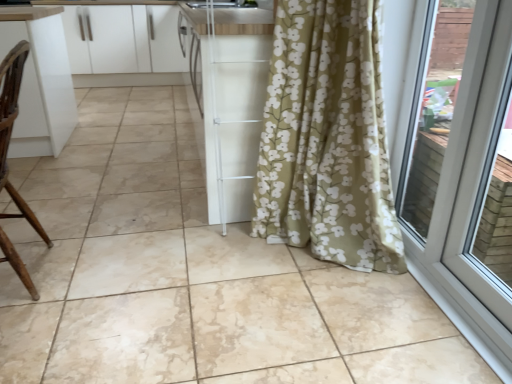
In order to click on white glossy cabinets at upper left in this screenshot , I will do `click(123, 39)`.

Considering the sizes of objects brown wood chair at left and white plastic door at right in the image provided, who is taller, brown wood chair at left or white plastic door at right?

white plastic door at right is taller.

Is brown wood chair at left positioned with its back to white plastic door at right?

Yes, brown wood chair at left is facing away from white plastic door at right.

From the image's perspective, is brown wood chair at left beneath white plastic door at right?

No, from the image's perspective, brown wood chair at left is not below white plastic door at right.

Would you consider brown wood chair at left to be distant from white plastic door at right?

Yes.

Is white glossy cabinets at upper left smaller than white plastic door at right?

No.

Is white glossy cabinets at upper left positioned with its back to white plastic door at right?

No, white glossy cabinets at upper left is not facing the opposite direction of white plastic door at right.

Considering the points (92, 9) and (480, 277), which point is behind, point (92, 9) or point (480, 277)?

The point (92, 9) is farther from the camera.

From the picture: How different are the orientations of white glossy cabinets at upper left and white plastic door at right in degrees?

white glossy cabinets at upper left and white plastic door at right are facing 90.2 degrees away from each other.

Which of these two, white plastic door at right or white glossy cabinets at upper left, stands shorter?

white glossy cabinets at upper left.

From a real-world perspective, is white plastic door at right on white glossy cabinets at upper left?

Yes, from a real-world perspective, white plastic door at right is on top of white glossy cabinets at upper left.

Which object is positioned more to the right, white plastic door at right or white glossy cabinets at upper left?

From the viewer's perspective, white plastic door at right appears more on the right side.

From the image's perspective, would you say white plastic door at right is shown under white glossy cabinets at upper left?

Yes.

Does white glossy cabinets at upper left have a greater height compared to brown wood chair at left?

Incorrect, the height of white glossy cabinets at upper left is not larger of that of brown wood chair at left.

Measure the distance between white glossy cabinets at upper left and brown wood chair at left.

white glossy cabinets at upper left and brown wood chair at left are 3.62 meters apart.

Considering the relative sizes of white glossy cabinets at upper left and brown wood chair at left in the image provided, is white glossy cabinets at upper left thinner than brown wood chair at left?

No, white glossy cabinets at upper left is not thinner than brown wood chair at left.

Are white glossy cabinets at upper left and brown wood chair at left far apart?

Indeed, white glossy cabinets at upper left is not near brown wood chair at left.

From a real-world perspective, which object rests below the other?

brown wood chair at left, from a real-world perspective.

Is white plastic door at right positioned with its back to brown wood chair at left?

No.

Is white plastic door at right closer to camera compared to brown wood chair at left?

Yes, white plastic door at right is closer to the camera.

Is white plastic door at right bigger or smaller than brown wood chair at left?

Considering their sizes, white plastic door at right takes up less space than brown wood chair at left.

Is point (4, 128) positioned after point (180, 53)?

No, it is in front of (180, 53).

Is brown wood chair at left positioned beyond the bounds of white glossy cabinets at upper left?

Yes, brown wood chair at left is outside of white glossy cabinets at upper left.

Between brown wood chair at left and white glossy cabinets at upper left, which one is positioned behind?

white glossy cabinets at upper left is further away from the camera.

How different are the orientations of brown wood chair at left and white glossy cabinets at upper left in degrees?

The angular difference between brown wood chair at left and white glossy cabinets at upper left is 87.9 degrees.

At what (x,y) coordinates should I click in order to perform the action: click on door above the brown wood chair at left (from a real-world perspective). Please return your answer as a coordinate pair (x, y). The image size is (512, 384). Looking at the image, I should click on (459, 168).

What are the coordinates of `cabinetry that appears on the left of white plastic door at right` in the screenshot? It's located at (123, 39).

Looking at the image, which one is located closer to white glossy cabinets at upper left, brown wood chair at left or white plastic door at right?

The object closer to white glossy cabinets at upper left is brown wood chair at left.

Looking at the image, which one is located further to white plastic door at right, brown wood chair at left or white glossy cabinets at upper left?

white glossy cabinets at upper left lies further to white plastic door at right than the other object.

Looking at the image, which one is located further to white glossy cabinets at upper left, white plastic door at right or brown wood chair at left?

white plastic door at right is positioned further to the anchor white glossy cabinets at upper left.

Considering their positions, is white glossy cabinets at upper left positioned further to white plastic door at right than brown wood chair at left?

Among the two, white glossy cabinets at upper left is located further to white plastic door at right.

When comparing their distances from brown wood chair at left, does white glossy cabinets at upper left or white plastic door at right seem further?

white glossy cabinets at upper left is further to brown wood chair at left.

From the image, which object appears to be nearer to brown wood chair at left, white plastic door at right or white glossy cabinets at upper left?

Based on the image, white plastic door at right appears to be nearer to brown wood chair at left.

Find the location of `chair located between white plastic door at right and white glossy cabinets at upper left in the depth direction`. chair located between white plastic door at right and white glossy cabinets at upper left in the depth direction is located at coordinates (12, 128).